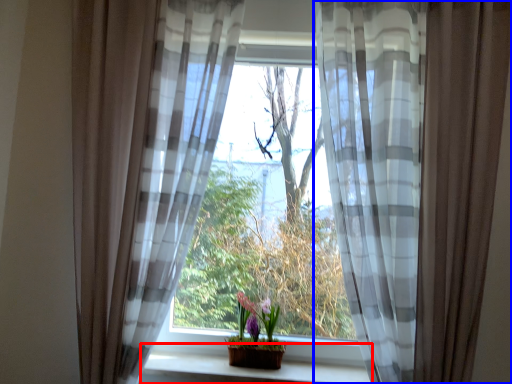
Question: Which object appears farthest to the camera in this image, window sill (highlighted by a red box) or curtain (highlighted by a blue box)?

Choices:
 (A) window sill
 (B) curtain

Answer: (A)